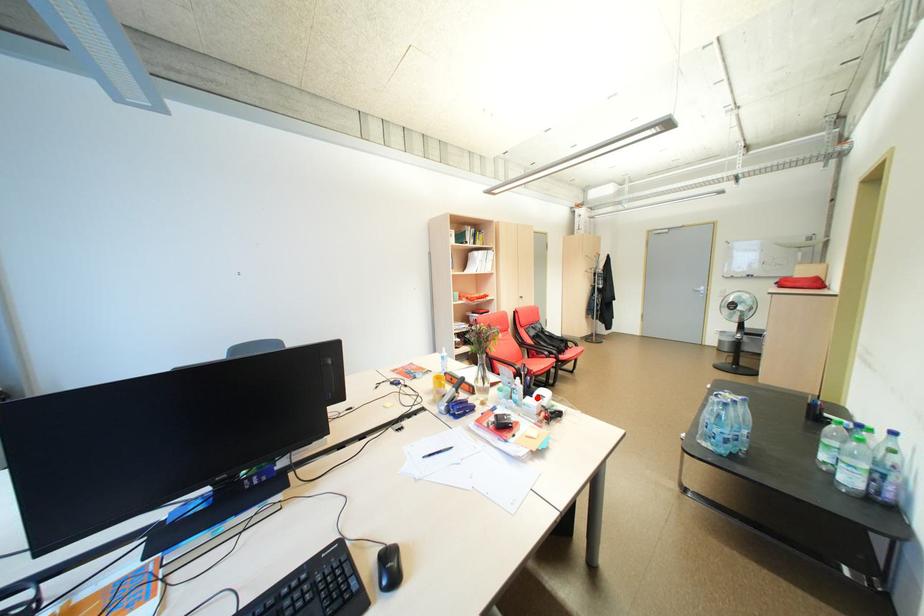
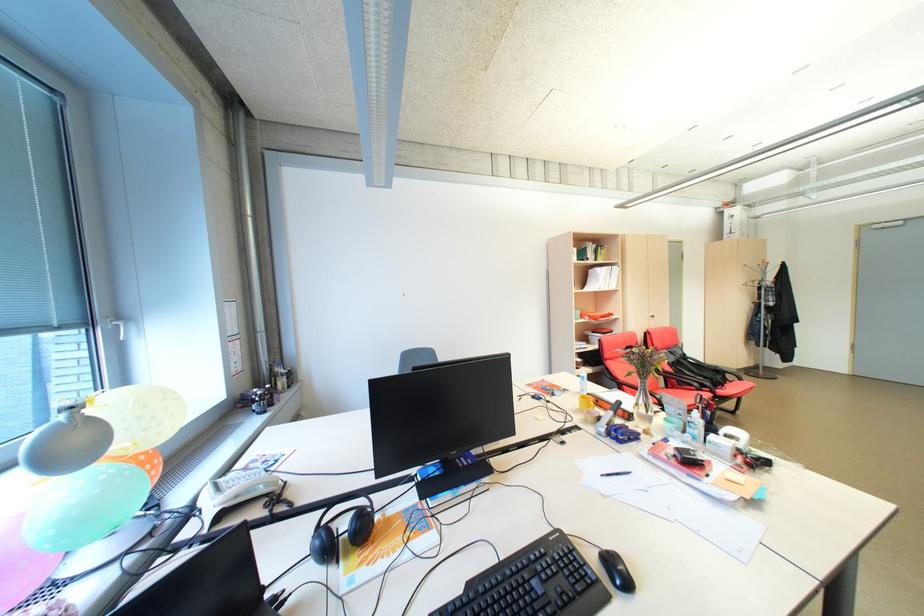
In the second image, find the point that corresponds to the highlighted location in the first image.

(722, 436)